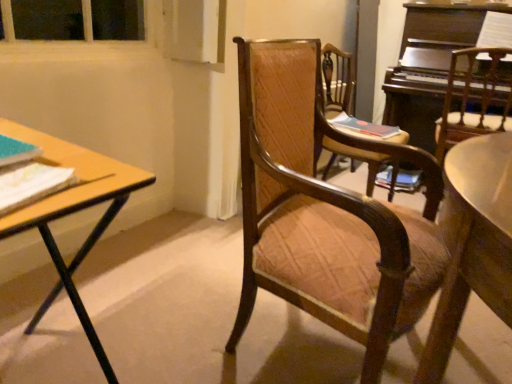
Locate an element on the screen. vacant space to the left of wooden chair at center, marked as the 1th chair in a left-to-right arrangement is located at coordinates (172, 315).